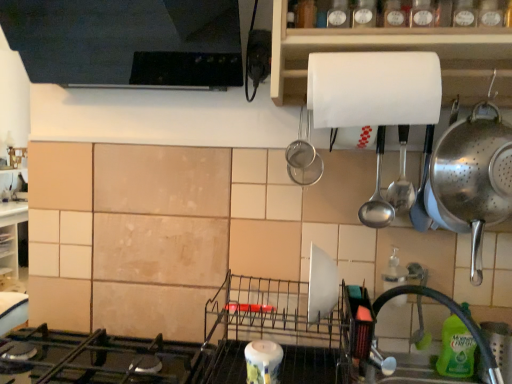
Question: Does white matte paper towel holder at upper center have a smaller size compared to polished stainless steel colander at right, arranged as the second appliance when ordered from the bottom?

Choices:
 (A) no
 (B) yes

Answer: (A)

Question: Can you confirm if white matte paper towel holder at upper center is taller than polished stainless steel colander at right, the first appliance when ordered from right to left?

Choices:
 (A) no
 (B) yes

Answer: (A)

Question: Does white matte paper towel holder at upper center have a lesser width compared to polished stainless steel colander at right, arranged as the 1th appliance when viewed from the top?

Choices:
 (A) no
 (B) yes

Answer: (A)

Question: Is white matte paper towel holder at upper center turned away from polished stainless steel colander at right, the first appliance when ordered from right to left?

Choices:
 (A) no
 (B) yes

Answer: (A)

Question: From a real-world perspective, does white matte paper towel holder at upper center sit lower than polished stainless steel colander at right, arranged as the 1th appliance when viewed from the top?

Choices:
 (A) no
 (B) yes

Answer: (A)

Question: Is polished stainless steel colander at right, the first appliance when ordered from right to left, inside white matte paper towel holder at upper center?

Choices:
 (A) yes
 (B) no

Answer: (B)

Question: Is black matte gas stove at lower left closer to camera compared to white matte paper towel at upper center?

Choices:
 (A) no
 (B) yes

Answer: (B)

Question: Are black matte gas stove at lower left and white matte paper towel at upper center far apart?

Choices:
 (A) no
 (B) yes

Answer: (A)

Question: Is black matte gas stove at lower left not inside white matte paper towel at upper center?

Choices:
 (A) yes
 (B) no

Answer: (A)

Question: From a real-world perspective, is black matte gas stove at lower left located beneath white matte paper towel at upper center?

Choices:
 (A) yes
 (B) no

Answer: (A)

Question: Can you confirm if black matte gas stove at lower left is bigger than white matte paper towel at upper center?

Choices:
 (A) no
 (B) yes

Answer: (B)

Question: From the image's perspective, does black matte gas stove at lower left appear lower than white matte paper towel at upper center?

Choices:
 (A) yes
 (B) no

Answer: (A)

Question: Is satin silver spoon at upper right bigger than white glossy candle at lower center, the second appliance in the right-to-left sequence?

Choices:
 (A) yes
 (B) no

Answer: (A)